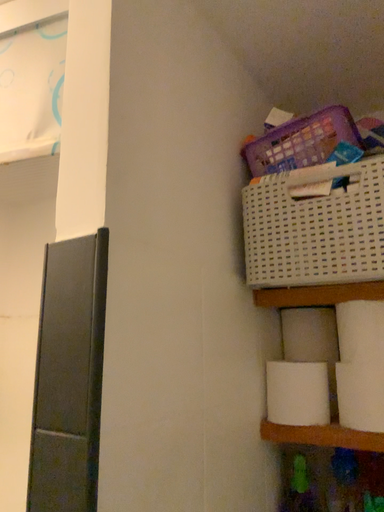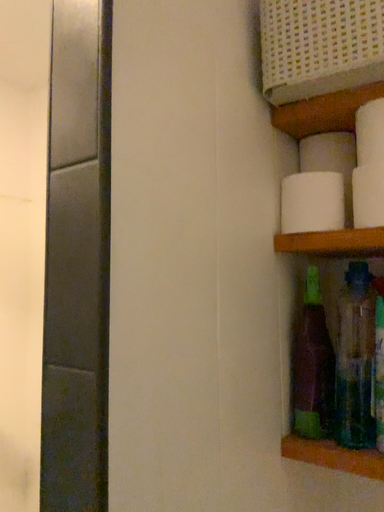
Question: Which way did the camera rotate in the video?

Choices:
 (A) rotated downward
 (B) rotated upward

Answer: (A)